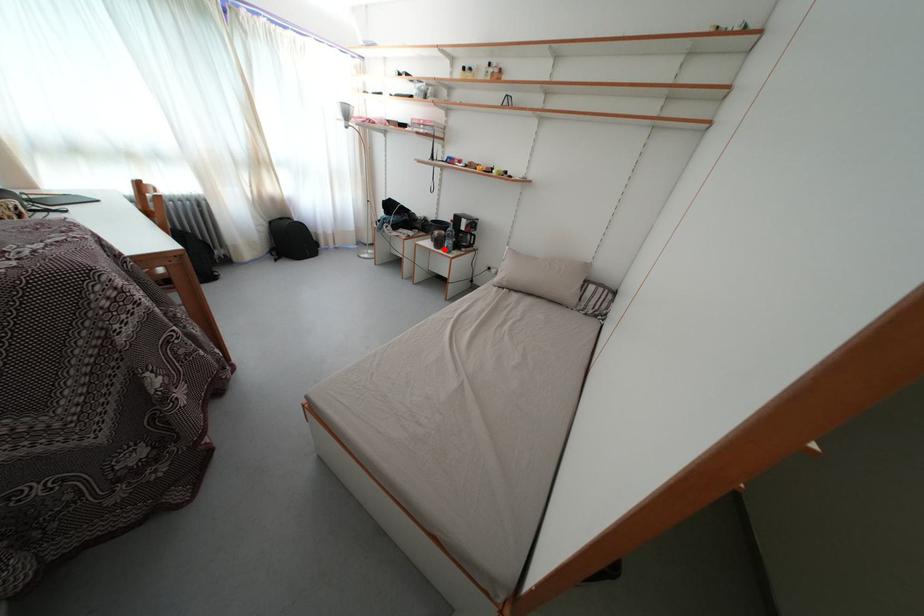
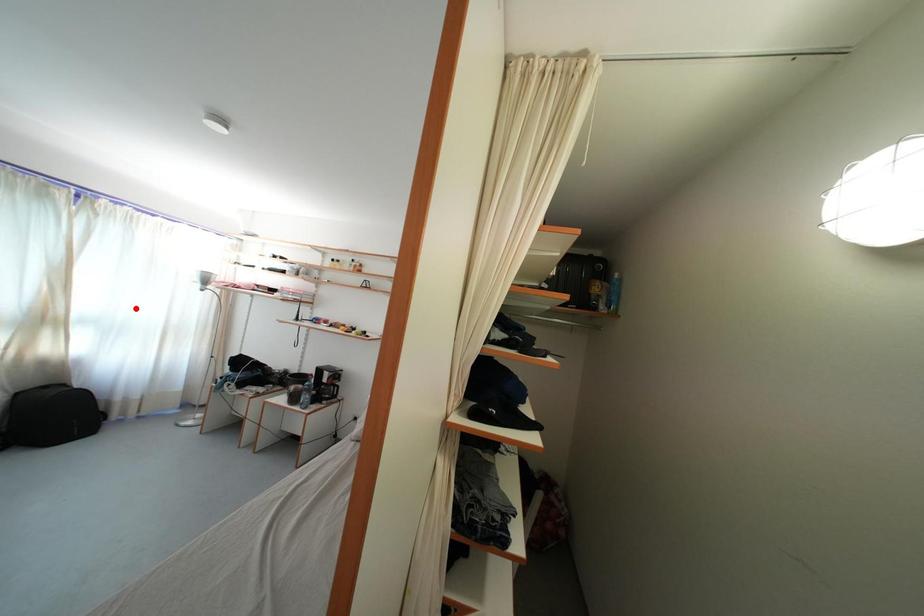
I am providing you with two images of the same scene from different viewpoints. A red point is marked on the first image and another point is marked on the second image. Are the points marked in image1 and image2 representing the same 3D position?

No